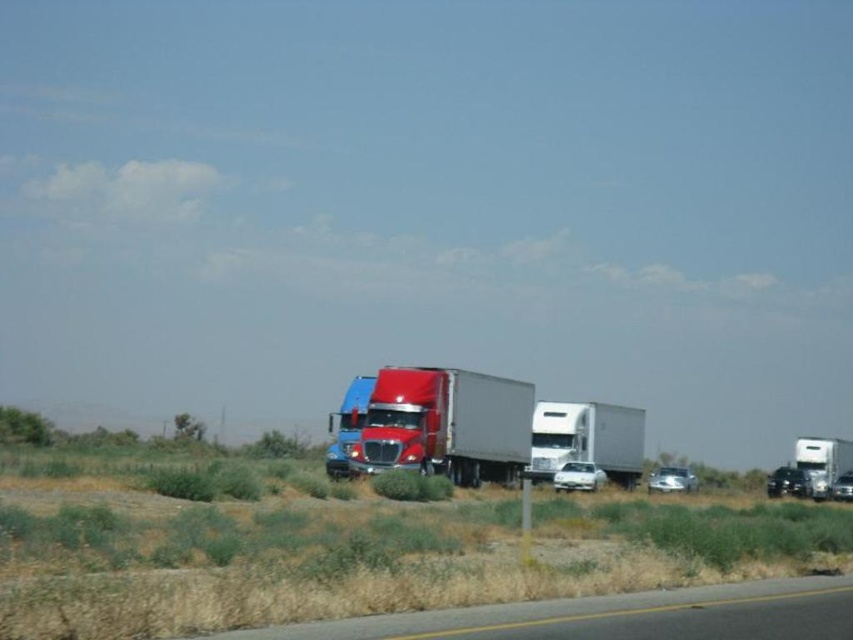
You are driving a car and see both the metallic silver trailer truck at center and the white matte trailer truck at center on the highway. Which truck should you pass first if you want to stay in your lane?

You should pass the metallic silver trailer truck at center first because it is positioned to the left of the white matte trailer truck at center, so it comes first in the lane.

You are a delivery driver planning to make a U turn on the gray asphalt road at lower center. The white matte trailer truck at center is currently parked on the road. Can you safely complete the U turn without moving the parked truck?

The gray asphalt road at lower center might be wider than white matte trailer truck at center, so it is possible that the road has sufficient width to allow the U turn. However, since the exact width difference is uncertain, proceed with caution and ensure there is enough space before attempting the maneuver.

You are driving a car and want to pass the metallic silver trailer truck at center and the white matte trailer truck at center on this highway. Which truck should you overtake first based on their positions?

You should overtake the metallic silver trailer truck at center first because it is closer to the viewer than the white matte trailer truck at center.